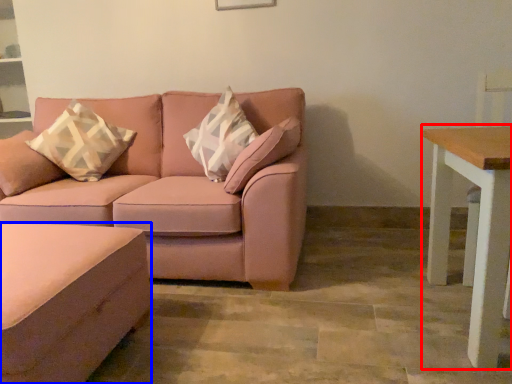
Question: Which point is further to the camera, table (highlighted by a red box) or footrest (highlighted by a blue box)?

Choices:
 (A) table
 (B) footrest

Answer: (A)